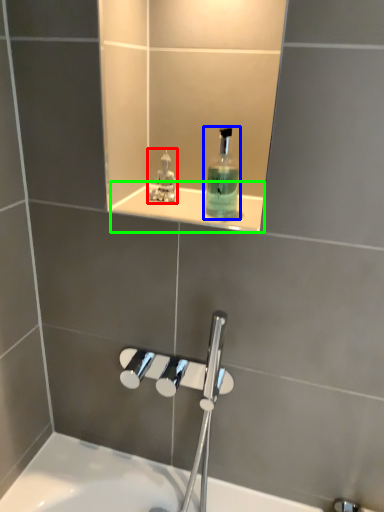
Question: Based on their relative distances, which object is farther from perfume (highlighted by a red box)? Choose from mouthwash (highlighted by a blue box) and ledge (highlighted by a green box).

Choices:
 (A) mouthwash
 (B) ledge

Answer: (A)